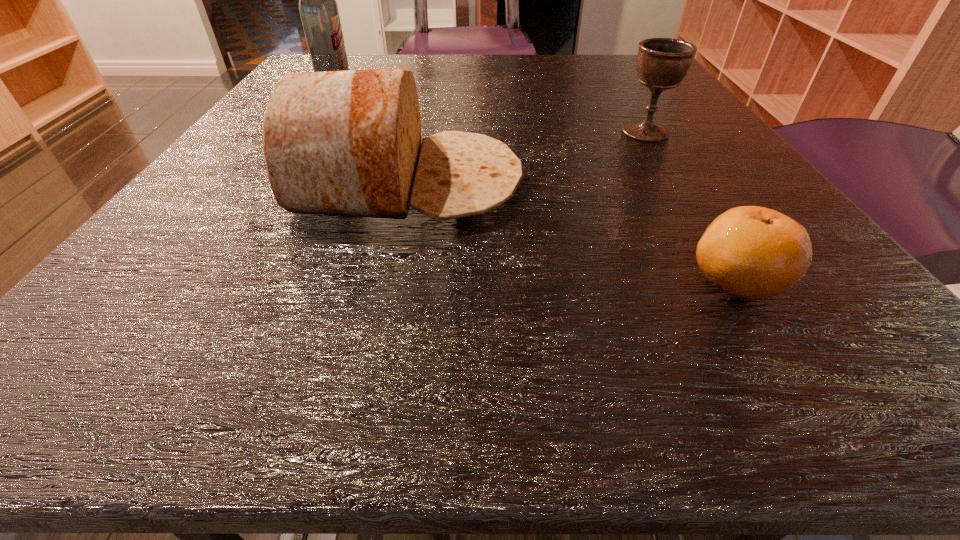
Find the location of a particular element. vodka is located at coordinates coord(318,8).

Identify the location of the farthest object. The width and height of the screenshot is (960, 540). (318, 8).

The image size is (960, 540). Identify the location of the second object from left to right. (345, 143).

The width and height of the screenshot is (960, 540). Identify the location of bread. (345, 143).

Identify the location of the second farthest object. The height and width of the screenshot is (540, 960). (662, 63).

What are the coordinates of `clementine` in the screenshot? It's located at tap(753, 252).

At what (x,y) coordinates should I click in order to perform the action: click on the shortest object. Please return your answer as a coordinate pair (x, y). This screenshot has height=540, width=960. Looking at the image, I should click on (753, 252).

Find the location of a particular element. The width and height of the screenshot is (960, 540). vacant area situated 0.070m on the front-facing side of the tallest object is located at coordinates (382, 78).

Where is `vacant region located at the sliced end of the bread`? vacant region located at the sliced end of the bread is located at coordinates point(600,183).

The image size is (960, 540). I want to click on blank space located 0.320m on the front of the chalice, so click(737, 280).